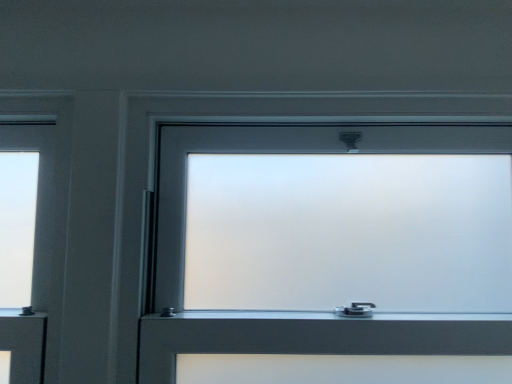
You are a GUI agent. You are given a task and a screenshot of the screen. Output one action in this format:
    pyautogui.click(x=<x>, y=<y>)
    Task: Click on the frosted glass window at center
    The width and height of the screenshot is (512, 384).
    Given the screenshot: What is the action you would take?
    pyautogui.click(x=282, y=152)

In order to face frosted glass window at center, should I rotate leftwards or rightwards?

To face it directly, rotate right by 10.403 degrees.

The image size is (512, 384). What do you see at coordinates (282, 152) in the screenshot? I see `frosted glass window at center` at bounding box center [282, 152].

Identify the location of frosted glass window at center. Image resolution: width=512 pixels, height=384 pixels. (282, 152).